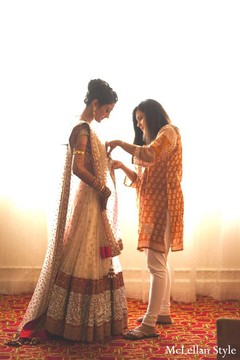
At what (x,y) coordinates should I click in order to perform the action: click on red/yellow design floor. Please return your answer as a coordinate pair (x, y). The height and width of the screenshot is (360, 240). Looking at the image, I should click on (184, 334).